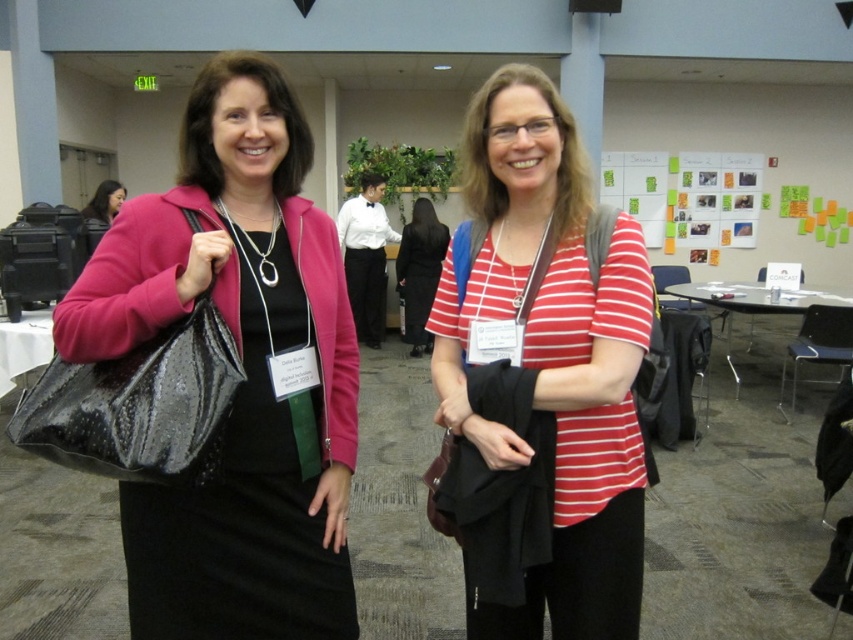
Consider the image. Which is more to the right, shiny black bag at left or striped cotton shirt at center?

From the viewer's perspective, striped cotton shirt at center appears more on the right side.

Does shiny black bag at left lie behind striped cotton shirt at center?

No, shiny black bag at left is in front of striped cotton shirt at center.

This screenshot has height=640, width=853. Find the location of `shiny black bag at left`. shiny black bag at left is located at coordinates pos(242,368).

Is shiny black bag at left closer to the viewer compared to black dress at center?

Yes, it is.

Is shiny black bag at left below black dress at center?

Correct, shiny black bag at left is located below black dress at center.

Where is `shiny black bag at left`? The width and height of the screenshot is (853, 640). shiny black bag at left is located at coordinates (242, 368).

Looking at this image, who is higher up, striped cotton shirt at center or black dress at center?

black dress at center is higher up.

Is point (602, 572) positioned in front of point (416, 248)?

Yes, it is.

Does point (640, 506) come in front of point (444, 246)?

Yes.

Locate an element on the screen. The height and width of the screenshot is (640, 853). striped cotton shirt at center is located at coordinates point(554,353).